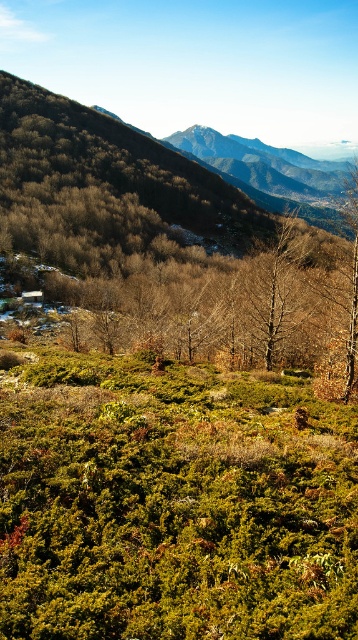
Does bare wood tree at center have a greater width compared to brown matte tree at upper right?

No, bare wood tree at center is not wider than brown matte tree at upper right.

Which of these two, bare wood tree at center or brown matte tree at upper right, stands shorter?

bare wood tree at center is shorter.

Find the location of a particular element. bare wood tree at center is located at coordinates (273, 289).

Identify the location of bare wood tree at center. (273, 289).